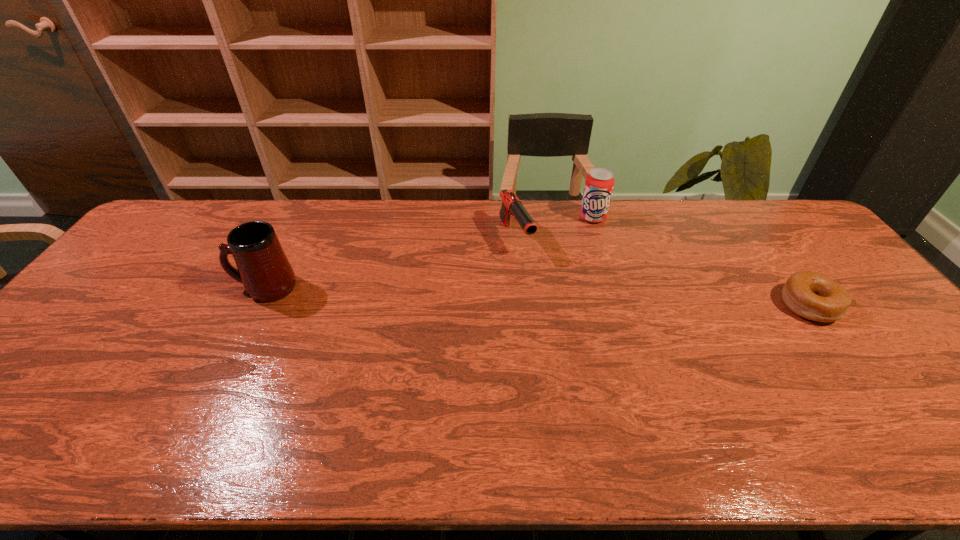
Locate an element on the screen. This screenshot has height=540, width=960. free space between the rightmost object and the leftmost object is located at coordinates (538, 296).

This screenshot has width=960, height=540. What are the coordinates of `free area in between the rightmost object and the leftmost object` in the screenshot? It's located at (538, 296).

The image size is (960, 540). Identify the location of the closest object relative to the third tallest object. (599, 183).

The width and height of the screenshot is (960, 540). I want to click on object that stands as the third closest to the second object from left to right, so click(x=812, y=295).

Identify the location of vacant region that satisfies the following two spatial constraints: 1. on the front side of the soda can; 2. on the right side of the bagel. (621, 306).

Where is `free space that satisfies the following two spatial constraints: 1. on the back side of the third object from right to left; 2. on the right side of the second object from right to left`? This screenshot has width=960, height=540. free space that satisfies the following two spatial constraints: 1. on the back side of the third object from right to left; 2. on the right side of the second object from right to left is located at coordinates (514, 218).

The image size is (960, 540). I want to click on vacant area in the image that satisfies the following two spatial constraints: 1. on the back side of the soda can; 2. on the left side of the gun, so click(x=514, y=218).

The height and width of the screenshot is (540, 960). In order to click on vacant space that satisfies the following two spatial constraints: 1. on the back side of the third tallest object; 2. on the right side of the soda can in this screenshot , I will do `click(514, 218)`.